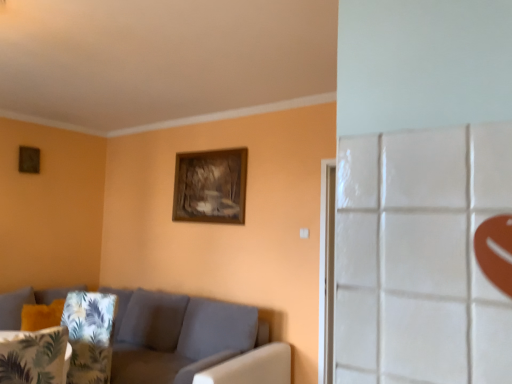
I want to click on green leafy fabric pillow at lower left, so click(34, 356).

Measure the distance between fabric couch at lower left and camera.

They are 8.75 feet apart.

Where is `green leafy fabric pillow at lower left`? green leafy fabric pillow at lower left is located at coordinates (34, 356).

From the image's perspective, is green leafy fabric pillow at lower left under wooden frame at upper center?

Yes.

Is green leafy fabric pillow at lower left completely or partially outside of wooden frame at upper center?

Absolutely, green leafy fabric pillow at lower left is external to wooden frame at upper center.

Is green leafy fabric pillow at lower left far from wooden frame at upper center?

green leafy fabric pillow at lower left is far away from wooden frame at upper center.

From a real-world perspective, does green leafy fabric pillow at lower left stand above wooden frame at upper center?

No.

Identify the location of picture frame behind the fabric couch at lower left. The image size is (512, 384). (210, 186).

Which is less distant, (x=132, y=336) or (x=188, y=168)?

Point (x=132, y=336)

From the picture: From the image's perspective, does fabric couch at lower left appear higher than wooden frame at upper center?

No, from the image's perspective, fabric couch at lower left is not above wooden frame at upper center.

Relative to fabric couch at lower left, is wooden frame at upper center in front or behind?

Visually, wooden frame at upper center is located behind fabric couch at lower left.

Can you confirm if wooden frame at upper center is positioned to the right of fabric couch at lower left?

Indeed, wooden frame at upper center is positioned on the right side of fabric couch at lower left.

You are a GUI agent. You are given a task and a screenshot of the screen. Output one action in this format:
    pyautogui.click(x=<x>, y=<y>)
    Task: Click on the studio couch located on the left of wooden frame at upper center
    
    Given the screenshot: What is the action you would take?
    pyautogui.click(x=192, y=342)

What's the angular difference between fabric couch at lower left and green leafy fabric pillow at lower left's facing directions?

The angular difference between fabric couch at lower left and green leafy fabric pillow at lower left is 86.1 degrees.

Considering the relative sizes of fabric couch at lower left and green leafy fabric pillow at lower left in the image provided, is fabric couch at lower left wider than green leafy fabric pillow at lower left?

Correct, the width of fabric couch at lower left exceeds that of green leafy fabric pillow at lower left.

From the image's perspective, who appears lower, fabric couch at lower left or green leafy fabric pillow at lower left?

fabric couch at lower left.

In the scene shown: Can you confirm if wooden frame at upper center is positioned to the left of green leafy fabric pillow at lower left?

In fact, wooden frame at upper center is to the right of green leafy fabric pillow at lower left.

In order to click on pillow in front of the wooden frame at upper center in this screenshot , I will do `click(34, 356)`.

Is wooden frame at upper center bigger than green leafy fabric pillow at lower left?

Actually, wooden frame at upper center might be smaller than green leafy fabric pillow at lower left.

Considering the sizes of objects wooden frame at upper center and green leafy fabric pillow at lower left in the image provided, who is shorter, wooden frame at upper center or green leafy fabric pillow at lower left?

With less height is green leafy fabric pillow at lower left.

From the picture: From the image's perspective, would you say green leafy fabric pillow at lower left is shown under fabric couch at lower left?

Actually, green leafy fabric pillow at lower left appears above fabric couch at lower left in the image.

Which is correct: green leafy fabric pillow at lower left is inside fabric couch at lower left, or outside of it?

The correct answer is: outside.

Between green leafy fabric pillow at lower left and fabric couch at lower left, which one has less height?

With less height is green leafy fabric pillow at lower left.

Which is more to the left, green leafy fabric pillow at lower left or fabric couch at lower left?

green leafy fabric pillow at lower left.

Identify the location of picture frame above the green leafy fabric pillow at lower left (from the image's perspective). This screenshot has width=512, height=384. (210, 186).

Where is `picture frame lying behind the fabric couch at lower left`? picture frame lying behind the fabric couch at lower left is located at coordinates (210, 186).

Estimate the real-world distances between objects in this image. Which object is closer to wooden frame at upper center, fabric couch at lower left or green leafy fabric pillow at lower left?

fabric couch at lower left is positioned closer to the anchor wooden frame at upper center.

From the image, which object appears to be farther from green leafy fabric pillow at lower left, wooden frame at upper center or fabric couch at lower left?

wooden frame at upper center is further to green leafy fabric pillow at lower left.

From the image, which object appears to be nearer to fabric couch at lower left, green leafy fabric pillow at lower left or wooden frame at upper center?

Based on the image, wooden frame at upper center appears to be nearer to fabric couch at lower left.

Looking at the image, which one is located closer to wooden frame at upper center, green leafy fabric pillow at lower left or fabric couch at lower left?

fabric couch at lower left is closer to wooden frame at upper center.

Considering their positions, is fabric couch at lower left positioned closer to green leafy fabric pillow at lower left than wooden frame at upper center?

fabric couch at lower left is closer to green leafy fabric pillow at lower left.

Which object lies nearer to the anchor point fabric couch at lower left, wooden frame at upper center or green leafy fabric pillow at lower left?

The object closer to fabric couch at lower left is wooden frame at upper center.

Where is `studio couch between green leafy fabric pillow at lower left and wooden frame at upper center along the z-axis`? The image size is (512, 384). studio couch between green leafy fabric pillow at lower left and wooden frame at upper center along the z-axis is located at coordinates (192, 342).